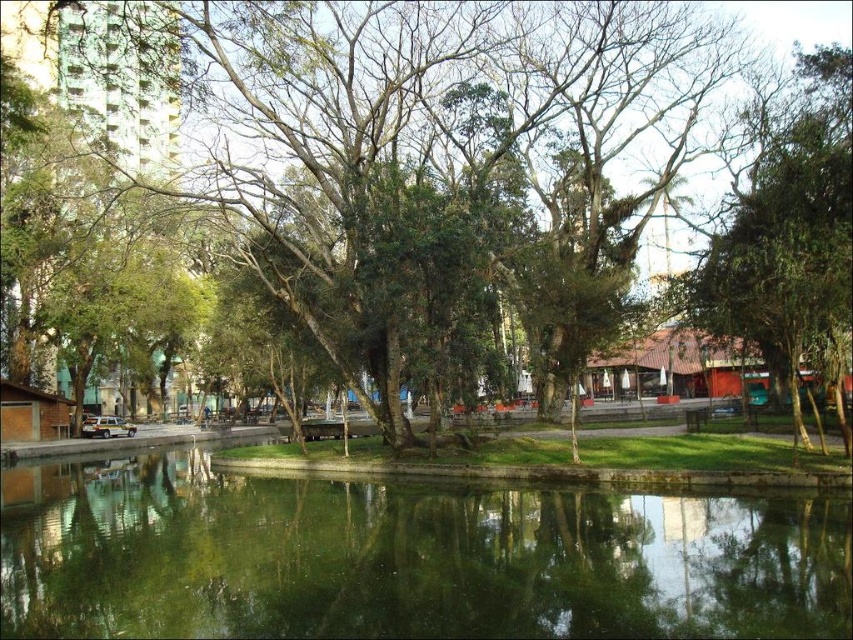
The image size is (853, 640). In order to click on green leafy tree at right in this screenshot , I will do `click(788, 236)`.

Which is more to the right, green leafy tree at right or green leafy tree at center?

green leafy tree at right is more to the right.

What do you see at coordinates (788, 236) in the screenshot? I see `green leafy tree at right` at bounding box center [788, 236].

I want to click on green leafy tree at right, so click(788, 236).

Can you confirm if green reflective water at center is shorter than green leafy tree at right?

Yes.

Which of these two, green reflective water at center or green leafy tree at right, stands shorter?

With less height is green reflective water at center.

What do you see at coordinates (405, 556) in the screenshot? I see `green reflective water at center` at bounding box center [405, 556].

At what (x,y) coordinates should I click in order to perform the action: click on green reflective water at center. Please return your answer as a coordinate pair (x, y). Looking at the image, I should click on (405, 556).

Which is behind, point (163, 474) or point (267, 22)?

Positioned behind is point (163, 474).

Can you confirm if green reflective water at center is positioned above green leafy tree at center?

No.

Locate an element on the screen. The width and height of the screenshot is (853, 640). green reflective water at center is located at coordinates (405, 556).